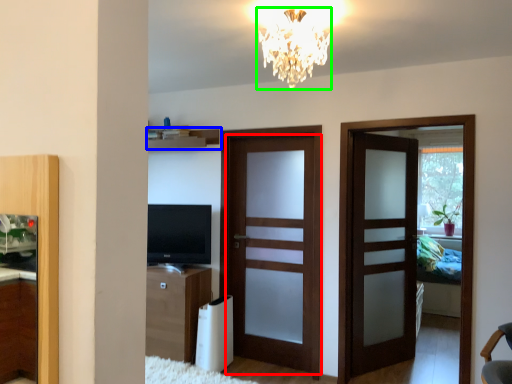
Question: Considering the real-world distances, which object is farthest from door (highlighted by a red box)? shelf (highlighted by a blue box) or lamp (highlighted by a green box)?

Choices:
 (A) shelf
 (B) lamp

Answer: (B)